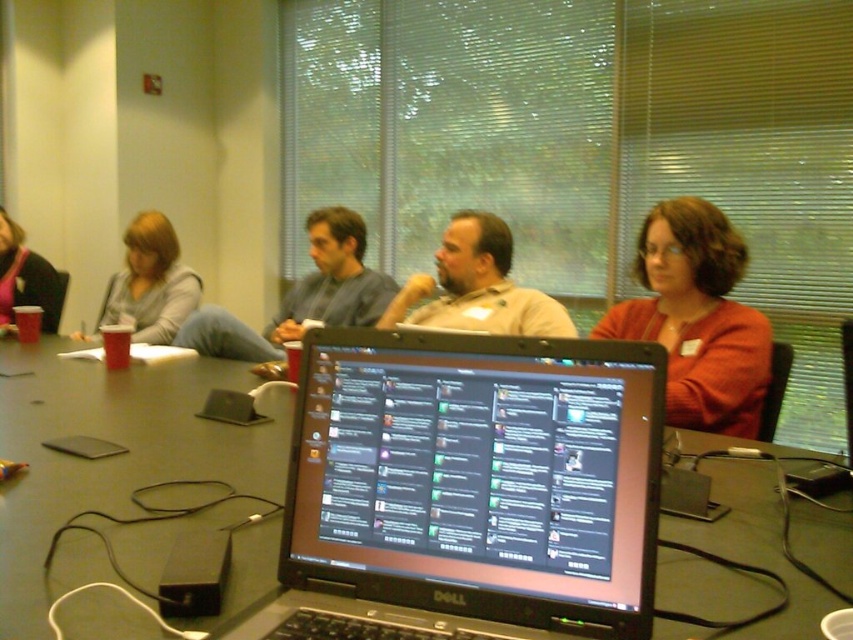
Question: In this image, where is matte orange sweater at center located relative to matte blue shirt at center?

Choices:
 (A) above
 (B) below

Answer: (B)

Question: Which point appears closest to the camera in this image?

Choices:
 (A) (390, 445)
 (B) (25, 253)
 (C) (650, 240)

Answer: (A)

Question: Observing the image, what is the correct spatial positioning of black glossy laptop at center in reference to matte orange sweater at center?

Choices:
 (A) above
 (B) below

Answer: (B)

Question: Which object is positioned closest to the black glossy laptop at center?

Choices:
 (A) matte blue shirt at center
 (B) matte gray sweater at upper left
 (C) matte beige shirt at center
 (D) black plastic table at center

Answer: (D)

Question: Which of the following is the farthest from the observer?

Choices:
 (A) matte orange sweater at center
 (B) matte blue shirt at center

Answer: (B)

Question: Does black plastic table at center have a smaller size compared to matte black laptop at left?

Choices:
 (A) yes
 (B) no

Answer: (B)